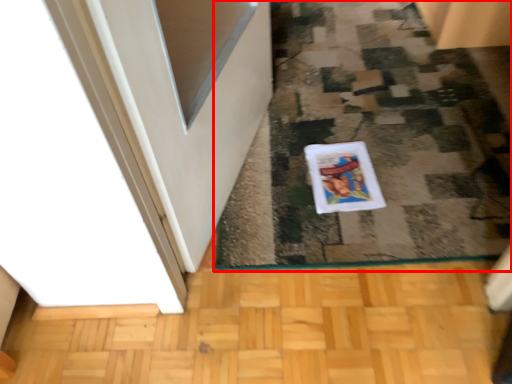
Question: From the image's perspective, where is doormat (annotated by the red box) located in relation to comic book in the image?

Choices:
 (A) below
 (B) above

Answer: (B)